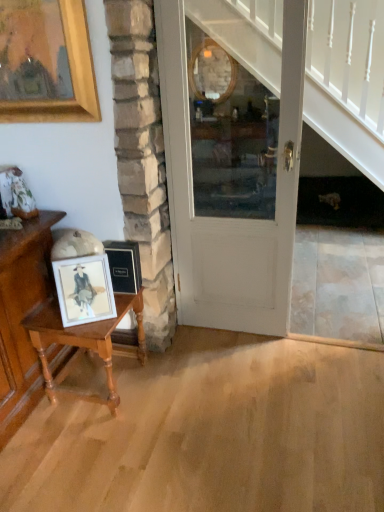
Question: Is the depth of wooden table at left greater than that of matte wooden picture frame at left?

Choices:
 (A) yes
 (B) no

Answer: (A)

Question: Is wooden table at left aimed at matte wooden picture frame at left?

Choices:
 (A) yes
 (B) no

Answer: (B)

Question: Is wooden table at left closer to camera compared to matte wooden picture frame at left?

Choices:
 (A) yes
 (B) no

Answer: (B)

Question: Does wooden table at left have a greater height compared to matte wooden picture frame at left?

Choices:
 (A) no
 (B) yes

Answer: (B)

Question: Considering the relative sizes of wooden table at left and matte wooden picture frame at left in the image provided, is wooden table at left bigger than matte wooden picture frame at left?

Choices:
 (A) yes
 (B) no

Answer: (A)

Question: From the image's perspective, does wooden table at left appear higher than matte wooden picture frame at left?

Choices:
 (A) no
 (B) yes

Answer: (A)

Question: From a real-world perspective, is wooden table at left located higher than white painted wood door at center?

Choices:
 (A) no
 (B) yes

Answer: (A)

Question: Is wooden table at left closer to camera compared to white painted wood door at center?

Choices:
 (A) yes
 (B) no

Answer: (B)

Question: Is wooden table at left looking in the opposite direction of white painted wood door at center?

Choices:
 (A) no
 (B) yes

Answer: (A)

Question: From the image's perspective, is wooden table at left on white painted wood door at center?

Choices:
 (A) yes
 (B) no

Answer: (B)

Question: From the image's perspective, is wooden table at left beneath white painted wood door at center?

Choices:
 (A) yes
 (B) no

Answer: (A)

Question: From a real-world perspective, is wooden table at left beneath white painted wood door at center?

Choices:
 (A) no
 (B) yes

Answer: (B)

Question: Is matte wooden picture frame at left to the right of wooden table at left from the viewer's perspective?

Choices:
 (A) no
 (B) yes

Answer: (B)